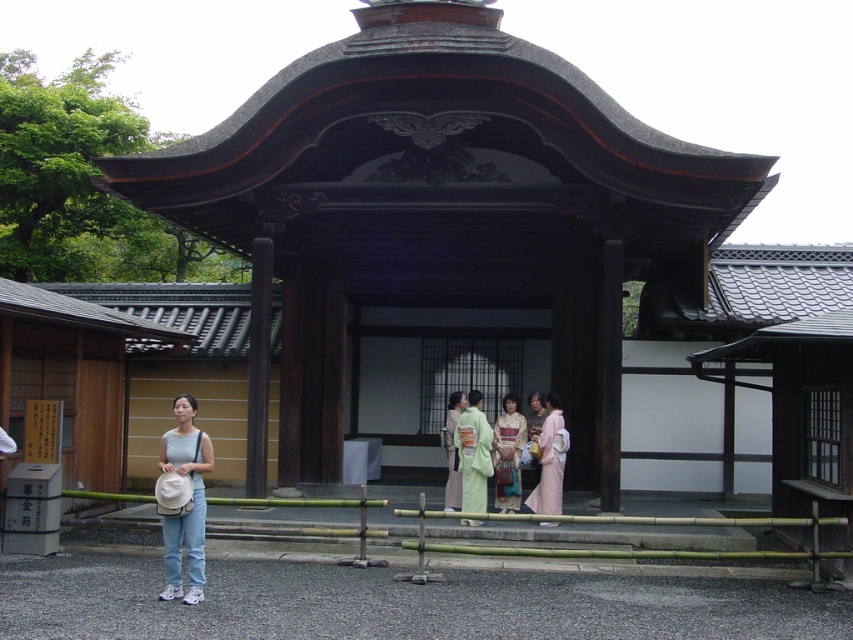
Which is in front, point (463, 476) or point (450, 401)?

Point (463, 476) is in front.

From the picture: Who is more distant from viewer, (x=483, y=429) or (x=450, y=444)?

Point (x=450, y=444)

Between point (485, 456) and point (457, 481), which one is positioned in front?

Point (485, 456) is more forward.

I want to click on light green silk kimono at center, so click(x=473, y=452).

Locate an element on the screen. Image resolution: width=853 pixels, height=640 pixels. pink silk kimono at center is located at coordinates (550, 460).

Which is below, pink silk kimono at center or silk kimono at center?

pink silk kimono at center

At what (x,y) coordinates should I click in order to perform the action: click on pink silk kimono at center. Please return your answer as a coordinate pair (x, y). The height and width of the screenshot is (640, 853). Looking at the image, I should click on (550, 460).

Does white fabric hat at lower left have a greater width compared to light green silk kimono at center?

Yes.

Does white fabric hat at lower left appear on the right side of light green silk kimono at center?

Incorrect, white fabric hat at lower left is not on the right side of light green silk kimono at center.

The height and width of the screenshot is (640, 853). Find the location of `white fabric hat at lower left`. white fabric hat at lower left is located at coordinates (190, 500).